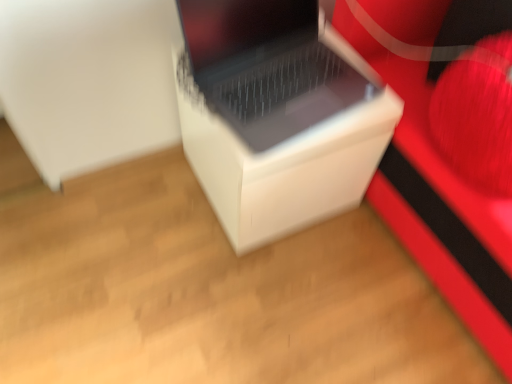
Question: Is the depth of white plastic laptop at center greater than that of white matte cardboard box at center?

Choices:
 (A) yes
 (B) no

Answer: (B)

Question: Does white plastic laptop at center have a lesser height compared to white matte cardboard box at center?

Choices:
 (A) yes
 (B) no

Answer: (A)

Question: Is white plastic laptop at center turned away from white matte cardboard box at center?

Choices:
 (A) no
 (B) yes

Answer: (A)

Question: Does white plastic laptop at center turn towards white matte cardboard box at center?

Choices:
 (A) no
 (B) yes

Answer: (A)

Question: Is white plastic laptop at center not near white matte cardboard box at center?

Choices:
 (A) no
 (B) yes

Answer: (A)

Question: From the image's perspective, does white plastic laptop at center appear lower than white matte cardboard box at center?

Choices:
 (A) no
 (B) yes

Answer: (A)

Question: Could you tell me if white matte cardboard box at center is facing matte white speaker at center?

Choices:
 (A) yes
 (B) no

Answer: (B)

Question: Is matte white speaker at center completely or partially inside white matte cardboard box at center?

Choices:
 (A) no
 (B) yes

Answer: (A)

Question: Is the surface of white matte cardboard box at center in direct contact with matte white speaker at center?

Choices:
 (A) yes
 (B) no

Answer: (B)

Question: Is white matte cardboard box at center further to the viewer compared to matte white speaker at center?

Choices:
 (A) yes
 (B) no

Answer: (A)

Question: From the image's perspective, is white matte cardboard box at center located above matte white speaker at center?

Choices:
 (A) no
 (B) yes

Answer: (A)

Question: Would you say white matte cardboard box at center is a long distance from matte white speaker at center?

Choices:
 (A) yes
 (B) no

Answer: (B)

Question: Can you confirm if white matte cardboard box at center is positioned to the right of white plastic laptop at center?

Choices:
 (A) no
 (B) yes

Answer: (A)